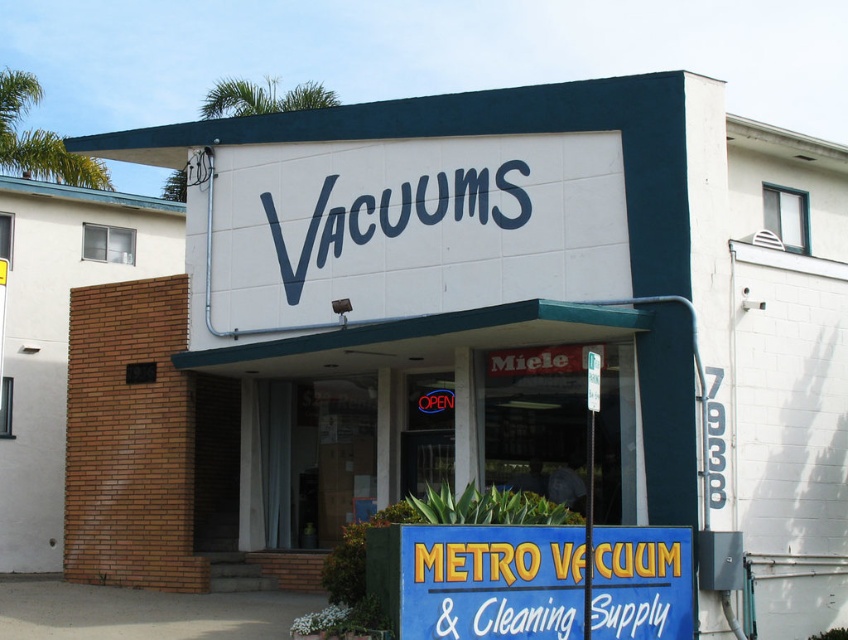
You are standing in front of the Metro Vacuum store and see the blue plastic sign at center and the blue painted sign at center. Which one is located to the right?

The blue plastic sign at center is positioned on the right side of the blue painted sign at center.

You are a delivery person who needs to place a new sign on the storefront. The new sign must be wider than the existing blue plastic sign at center. Where should you place it so it doesn not overlap with the white plastic sign at lower center?

The blue plastic sign at center is wider than the white plastic sign at lower center. To place the new sign wider than the blue plastic sign at center without overlapping the white plastic sign at lower center, position it above or to the side of the existing signs, ensuring there is enough space.